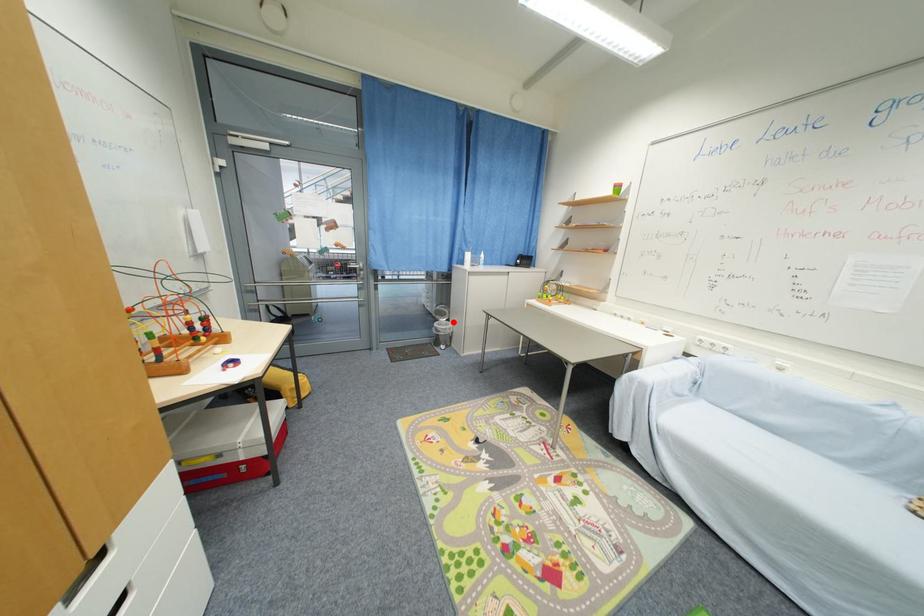
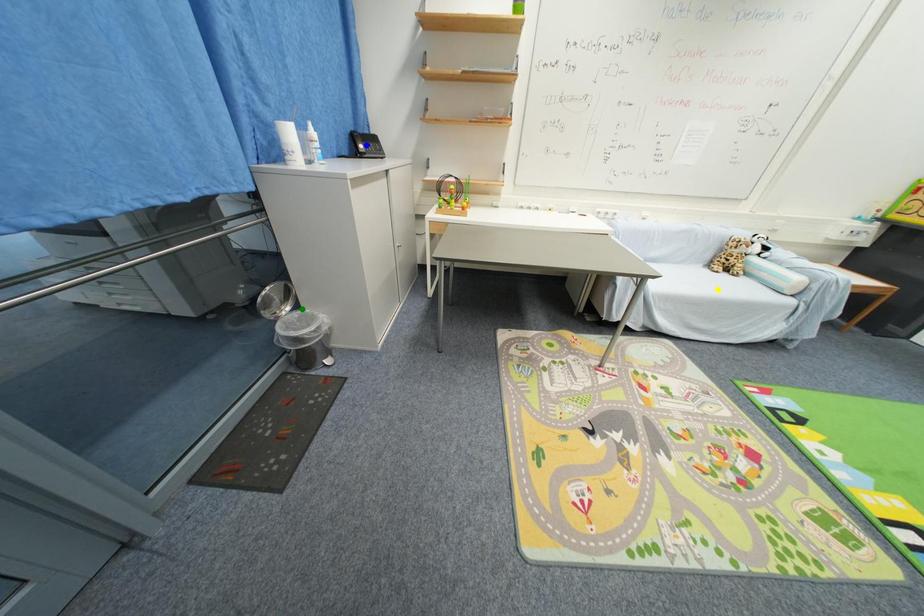
Question: I am providing you with two images of the same scene from different viewpoints. A red point is marked on the first image. You are given multiple points on the second image. Which mark in image 2 goes with the point in image 1?

Choices:
 (A) green point
 (B) yellow point
 (C) blue point

Answer: (A)